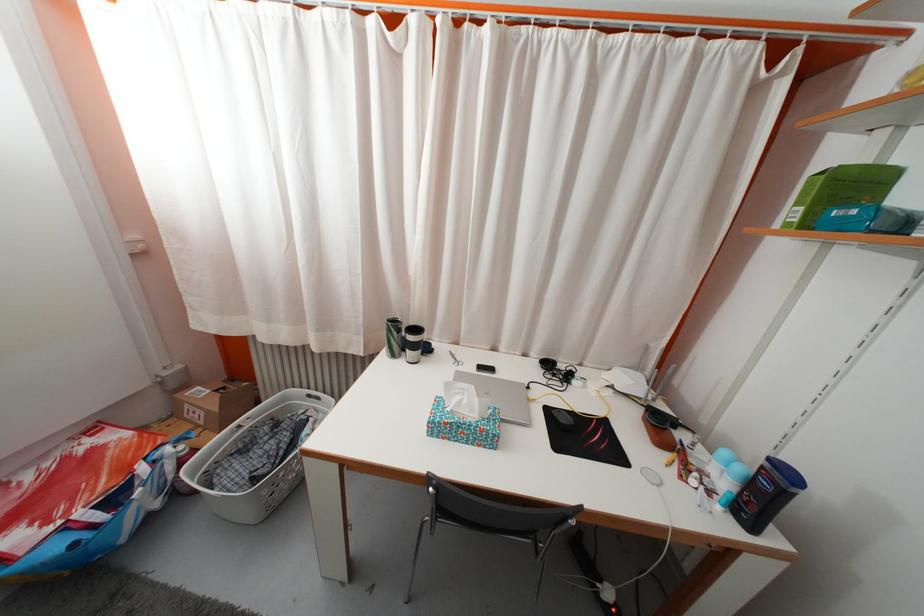
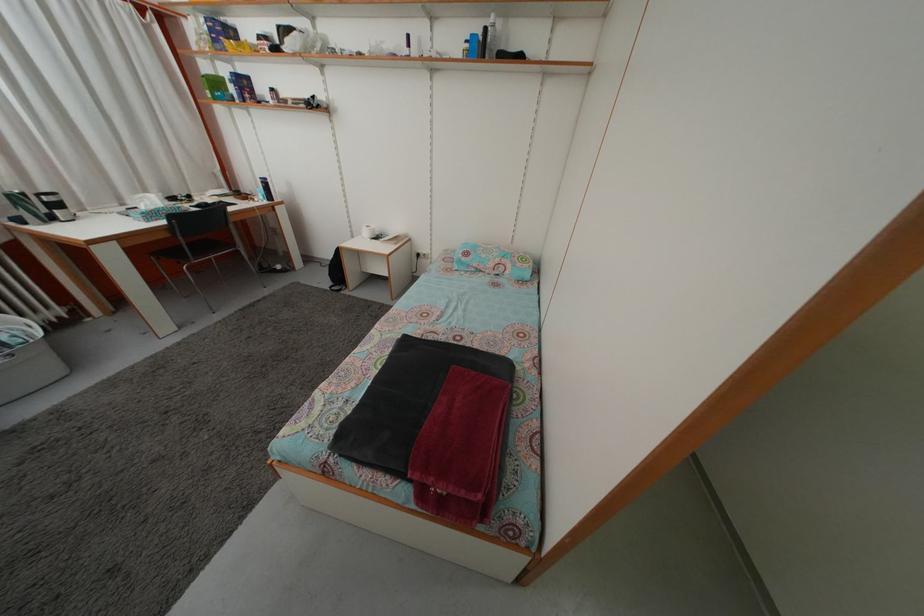
In the second image, find the point that corresponds to (859,195) in the first image.

(223, 91)